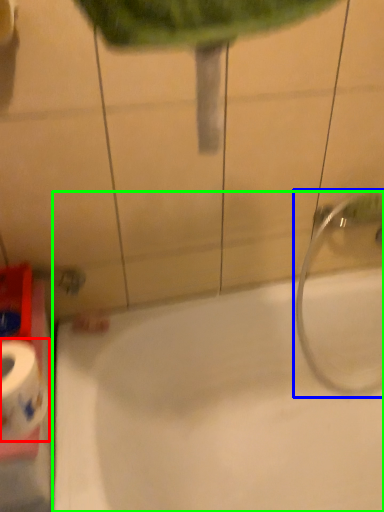
Question: Estimate the real-world distances between objects in this image. Which object is closer to toilet paper (highlighted by a red box), plumbing fixture (highlighted by a blue box) or bathtub (highlighted by a green box)?

Choices:
 (A) plumbing fixture
 (B) bathtub

Answer: (B)